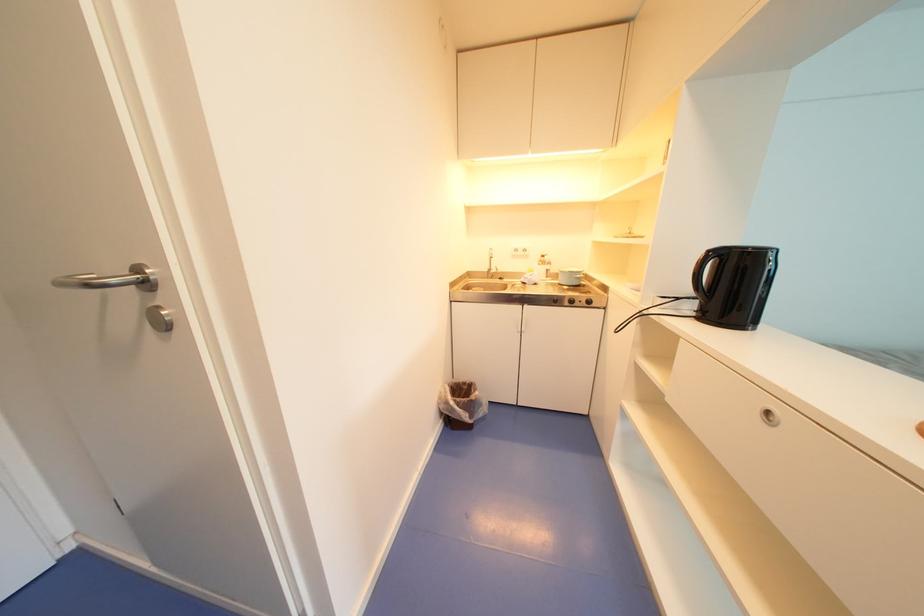
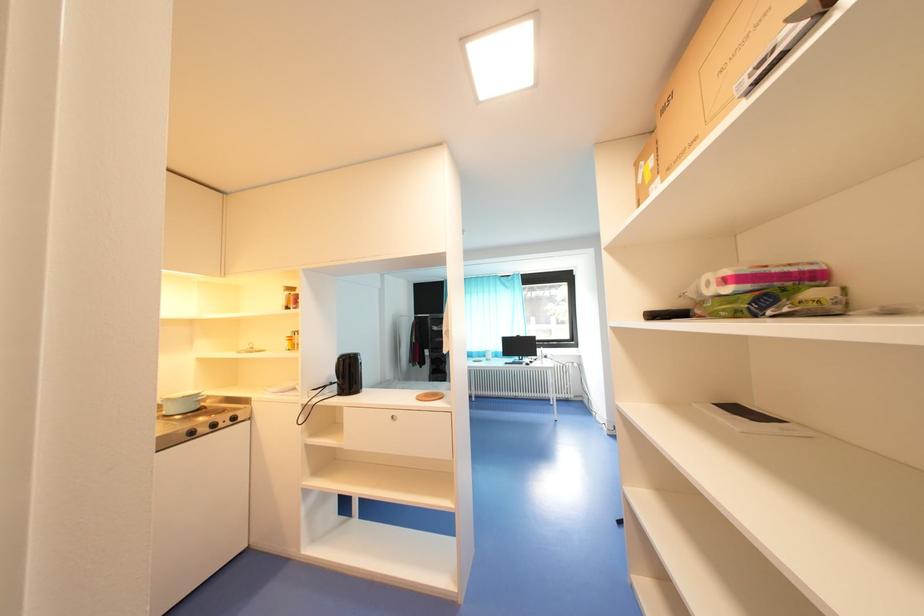
Question: The camera is either moving clockwise (left) or counter-clockwise (right) around the object. The first image is from the beginning of the video and the second image is from the end. Is the camera moving left or right when shooting the video?

Choices:
 (A) Left
 (B) Right

Answer: (A)